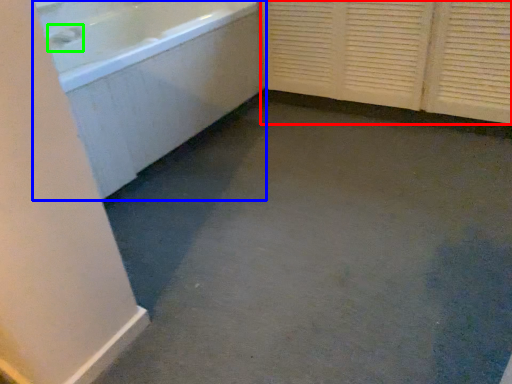
Question: Based on their relative distances, which object is nearer to screen door (highlighted by a red box)? Choose from bathtub (highlighted by a blue box) and faucet (highlighted by a green box).

Choices:
 (A) bathtub
 (B) faucet

Answer: (A)